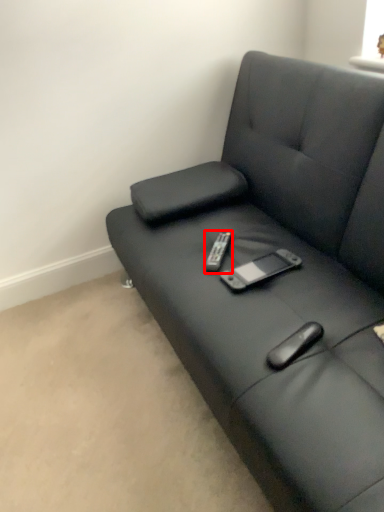
Question: Observing the image, what is the correct spatial positioning of remote (annotated by the red box) in reference to studio couch?

Choices:
 (A) right
 (B) left

Answer: (B)